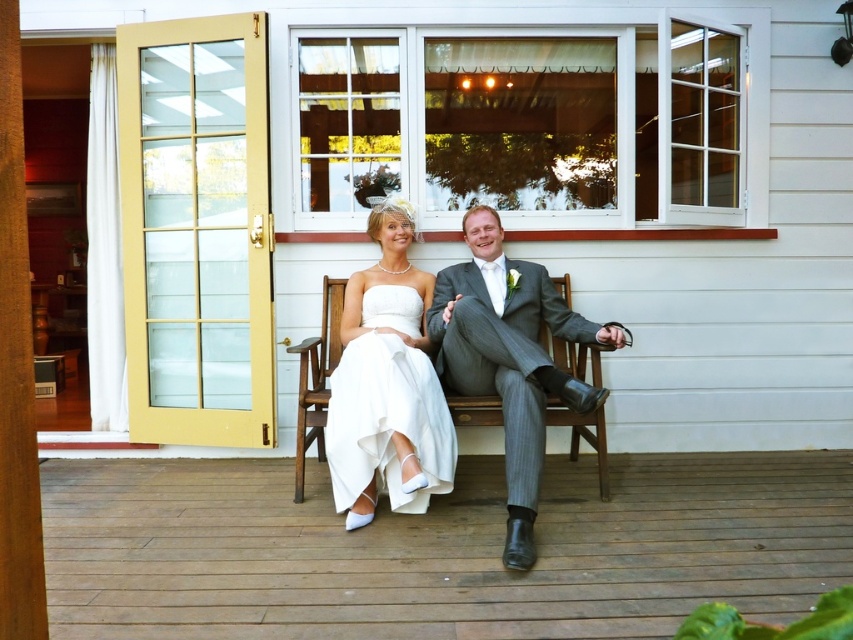
From the picture: You are a photographer planning to capture a closeup shot of the white satin dress at center. You need to ensure that the wooden floor at lower center does not occupy more than half of the frame. Based on their sizes, will this be possible?

The wooden floor at lower center is wider than the white satin dress at center. Since the floor is larger in width, it would occupy more than half of the frame, making it difficult to achieve the desired composition without adjusting the camera angle or position.

You are a photographer setting up for a wedding photo. You need to ensure that the wooden floor at lower center and the white satin dress at center are both visible in the frame. Based on their heights, which object might require adjusting the camera angle to capture properly?

→ The wooden floor at lower center is shorter than the white satin dress at center, so the camera angle might need to be lowered to ensure the wooden floor is visible while still capturing the white satin dress.

You are a photographer planning to take a photo of the wooden floor at lower center and the wooden bench at center. Which object should you focus on first if you want to capture both in a single shot without moving the camera?

The wooden floor at lower center is bigger than the wooden bench at center, so you should focus on the wooden floor at lower center first to ensure it fills the frame appropriately before adjusting for the smaller wooden bench at center.